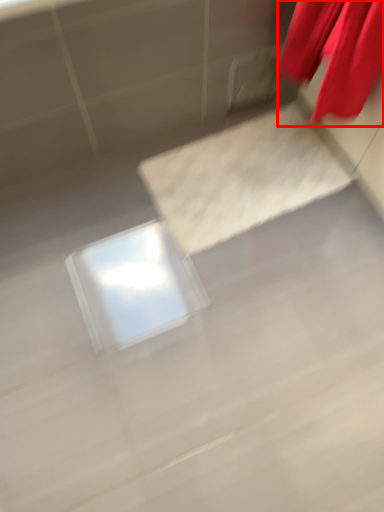
Question: From the image's perspective, considering the relative positions of curtain (annotated by the red box) and concrete in the image provided, where is curtain (annotated by the red box) located with respect to the staircase?

Choices:
 (A) below
 (B) above

Answer: (B)